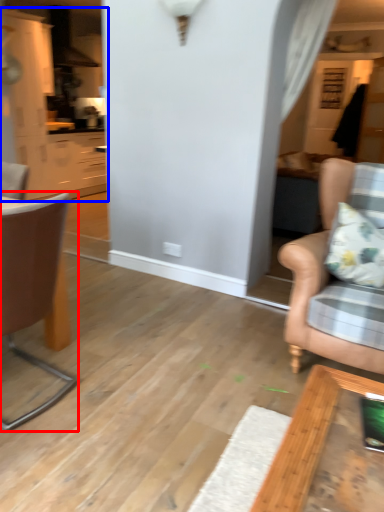
Question: Which object is further to the camera taking this photo, chair (highlighted by a red box) or cabinetry (highlighted by a blue box)?

Choices:
 (A) chair
 (B) cabinetry

Answer: (B)